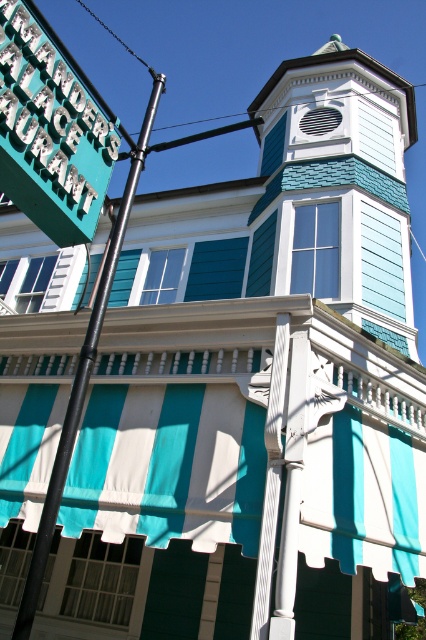
You are standing in front of the building and notice the teal plastic sign at upper left and the black metal pole at left. Which object is positioned to the right when viewed from the front?

The teal plastic sign at upper left is to the right of the black metal pole at left, so the teal plastic sign at upper left is positioned to the right when viewed from the front.

You are standing in front of the building and notice two points marked on the facade. The first point is at coordinate point (342, 42) and the second is at point (69, 208). If you want to touch both points starting from the nearest one, which point should you touch first?

You should touch point (69, 208) first because it is closer to you than point (342, 42), which is further away.